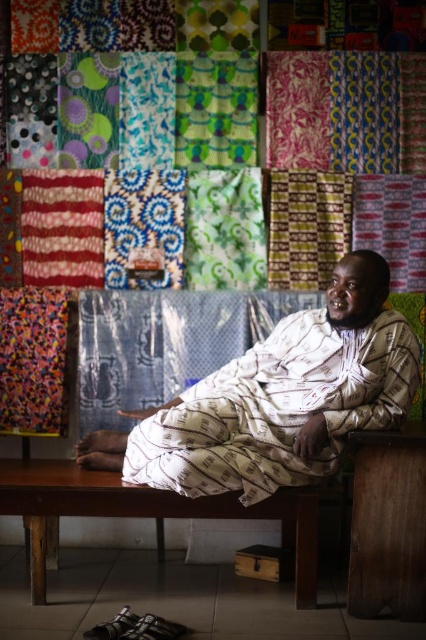
You are a customer at the market stall and want to know if the matte blue fabric at center can be seen over the brown wooden bench at lower center. Based on the scene description, can you determine this?

The matte blue fabric at center is taller than the brown wooden bench at lower center, so yes, the matte blue fabric at center can be seen over the brown wooden bench at lower center.

Where is the white printed fabric at center located in the coordinate system?

The white printed fabric at center is located at point (278, 400) in the coordinate system.